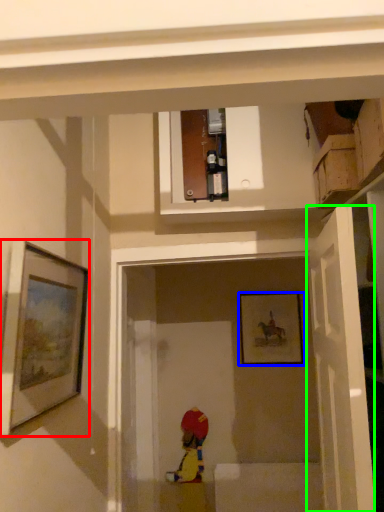
Question: Estimate the real-world distances between objects in this image. Which object is farther from picture frame (highlighted by a red box), picture frame (highlighted by a blue box) or door (highlighted by a green box)?

Choices:
 (A) picture frame
 (B) door

Answer: (A)